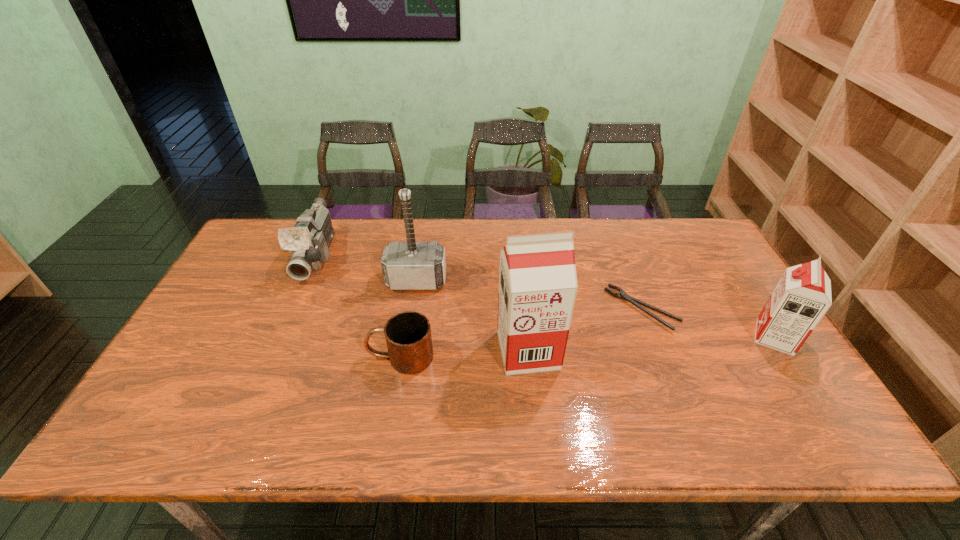
You are a GUI agent. You are given a task and a screenshot of the screen. Output one action in this format:
    pyautogui.click(x=<x>, y=<y>)
    Task: Click on the left soya milk
    
    Given the screenshot: What is the action you would take?
    pyautogui.click(x=538, y=285)

Identify the location of the tallest object. This screenshot has height=540, width=960. (538, 285).

The image size is (960, 540). Find the location of `the rightmost object`. the rightmost object is located at coordinates (801, 298).

The width and height of the screenshot is (960, 540). Identify the location of the right soya milk. (801, 298).

Locate an element on the screen. This screenshot has height=540, width=960. the leftmost object is located at coordinates (308, 241).

Identify the location of the fourth tallest object. The height and width of the screenshot is (540, 960). (308, 241).

Find the location of `hammer`. hammer is located at coordinates tap(411, 265).

The height and width of the screenshot is (540, 960). What are the coordinates of `tongs` in the screenshot? It's located at (623, 295).

This screenshot has width=960, height=540. Identify the location of the shortest object. (623, 295).

Find the location of a particular element. This screenshot has width=960, height=540. the second shortest object is located at coordinates (408, 336).